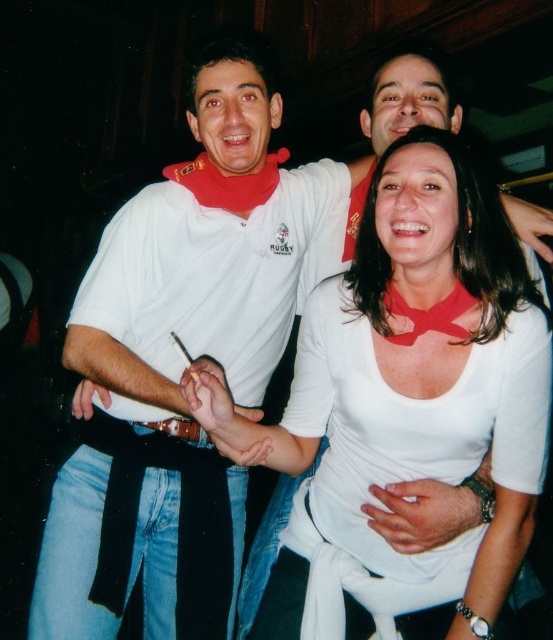
You are standing at the point marked by the coordinates point (373,332). You want to move to the door located at the far end of the room. The door is 1.5 meters away from your current position. Can you reach the door without moving more than 1.5 meters?

The point (373,332) is 1.22 meters away from the viewer, so yes, you can reach the door located 1.5 meters away without exceeding the distance.

Looking at this image, you are trying to identify the central figure in the image. According to the scene description, where exactly is the white matte shirt at center positioned?

The white matte shirt at center is located at point (404,404).